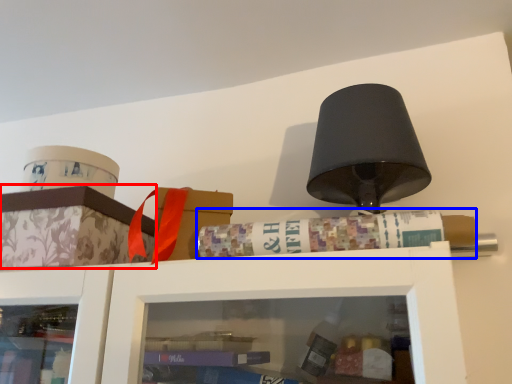
Question: Which object appears farthest to the camera in this image, cabinetry (highlighted by a red box) or book (highlighted by a blue box)?

Choices:
 (A) cabinetry
 (B) book

Answer: (A)